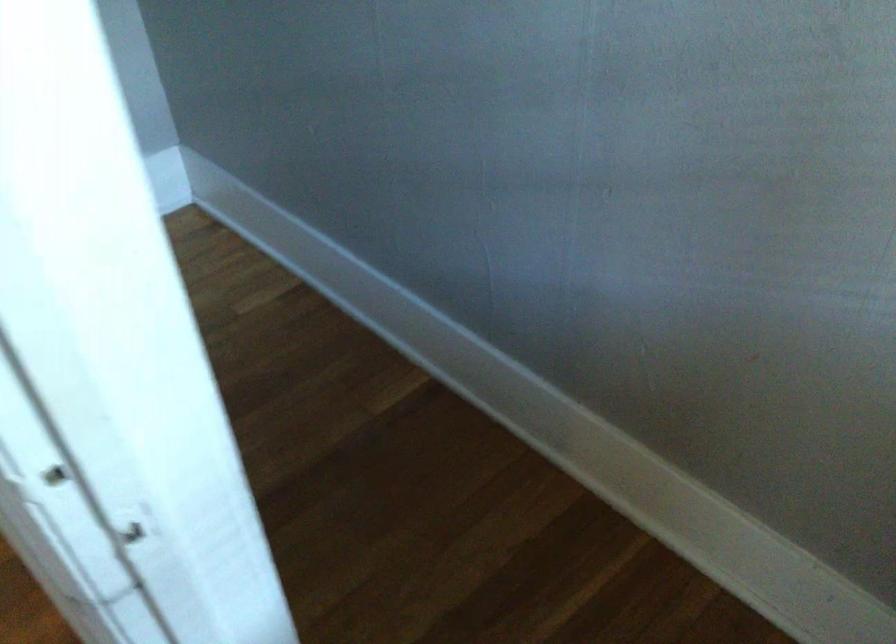
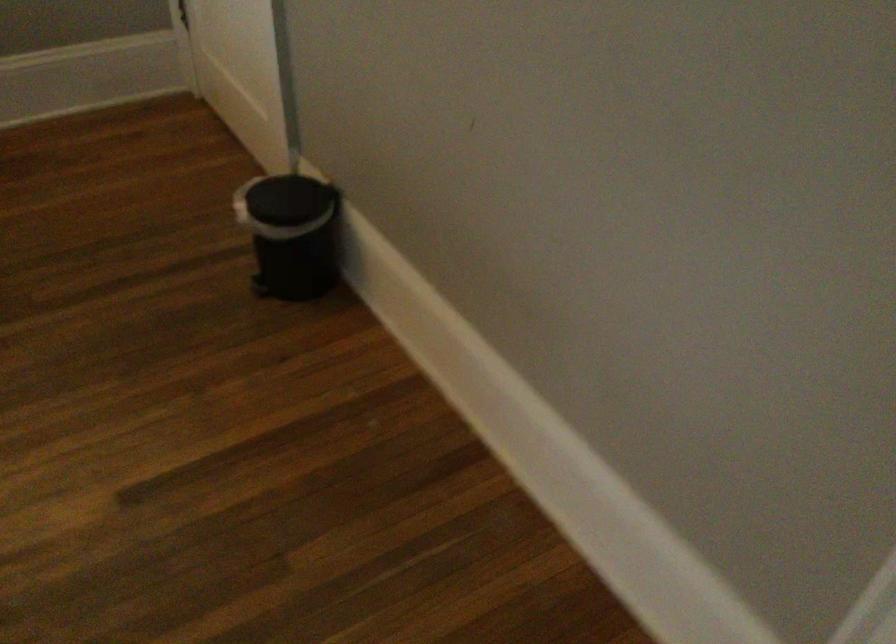
Question: In a continuous first-person perspective shot, in which direction is the camera moving?

Choices:
 (A) Left
 (B) Right
 (C) Forward
 (D) Backward

Answer: (A)